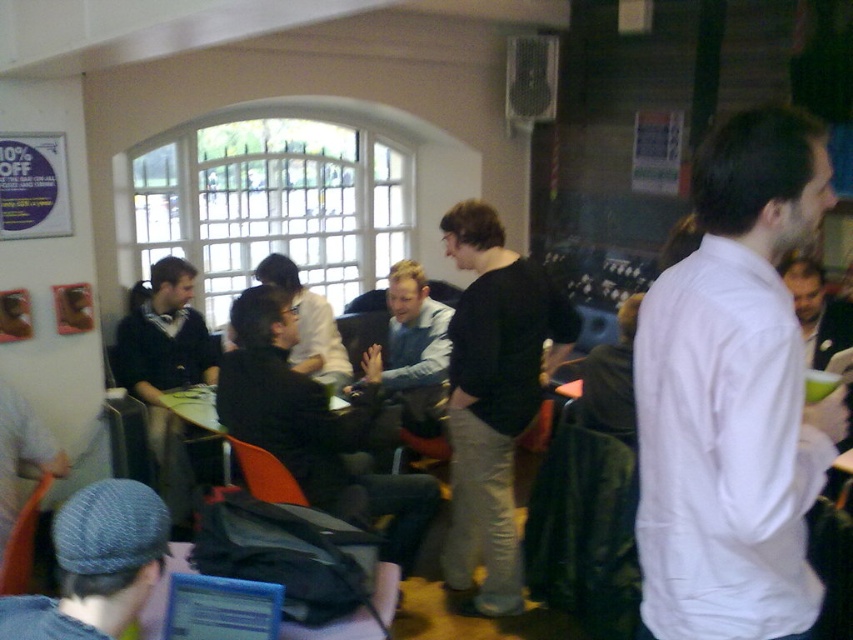
You are standing in the room and want to take a photo of both point (483, 360) and point (173, 452). Which point should you focus on first to ensure both are in clear view?

You should focus on point (483, 360) first because it is closer to the camera than point (173, 452), ensuring both points are in focus when using a camera with a fixed focal length.

You are organizing a clothing donation drive and need to arrange items by color. You see a dark brown leather jacket at center and a dark gray sweater at center. Which item is positioned to the left when viewed from the front of the room?

The dark brown leather jacket at center is to the left of the dark gray sweater at center.

You are organizing a presentation in this room and need to set up the blue plastic laptop at lower center. However, there is a matte black jacket at left in the way. Can you move the laptop forward without moving the jacket?

The blue plastic laptop at lower center is behind the matte black jacket at left, so you can move it forward to a position in front of the matte black jacket at left without needing to move the jacket itself.